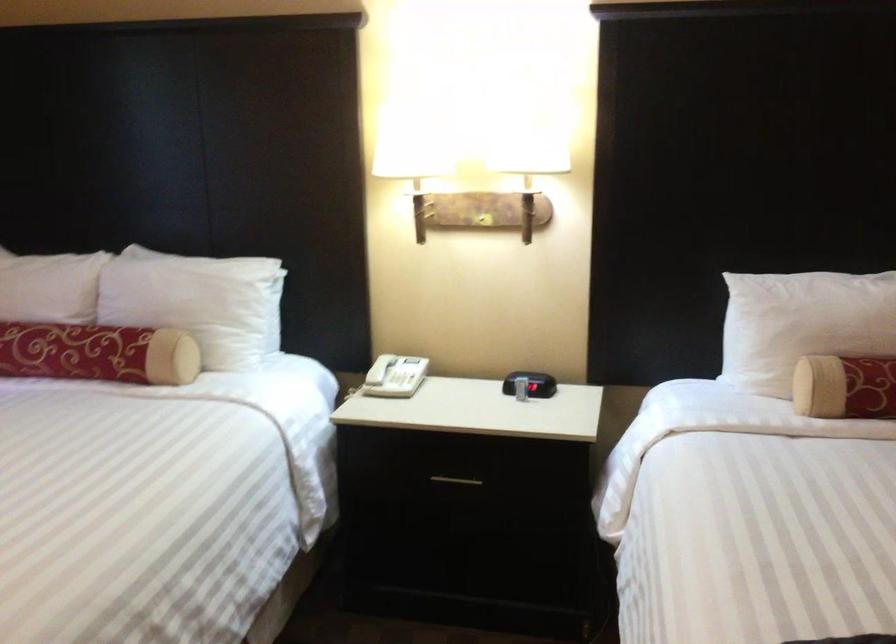
What do you see at coordinates (483, 220) in the screenshot? This screenshot has width=896, height=644. I see `the brass lamp switch` at bounding box center [483, 220].